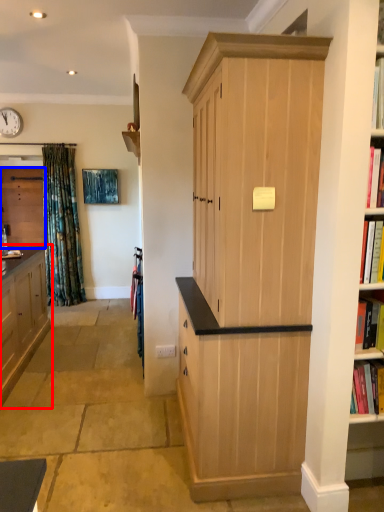
Question: Which of the following is the farthest to the observer, cabinetry (highlighted by a red box) or cabinetry (highlighted by a blue box)?

Choices:
 (A) cabinetry
 (B) cabinetry

Answer: (B)